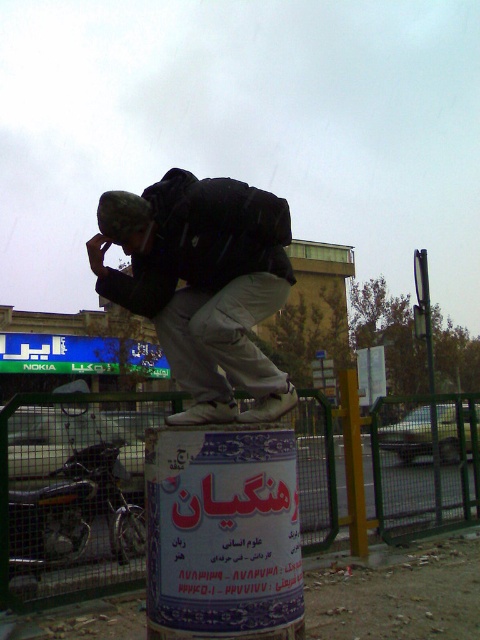
You are a delivery person trying to pass through the green metal fence at lower center while carrying the matte black backpack at left. Can you fit through the fence without removing the backpack?

The green metal fence at lower center is thinner than the matte black backpack at left, so the backpack may not fit through the fence. It is recommended to remove the backpack before attempting to pass through the fence.

You are a delivery person trying to navigate through the urban area shown. You need to deliver a package to a location behind the green metal fence at lower center. However, your path is blocked by the matte black backpack at left. Based on the scene description, can you determine if you can move the backpack to access the fence?

The green metal fence at lower center is to the right of the matte black backpack at left, so you can move the backpack to the left to access the fence.

You are a delivery person trying to navigate through the urban scene. You need to place a package on the green metal fence at lower center. However, there is a matte black backpack at left in your way. Can you place the package on the fence without moving the backpack?

The green metal fence at lower center is positioned under the matte black backpack at left, so the backpack is blocking access to the fence. You cannot place the package on the fence without moving the backpack.